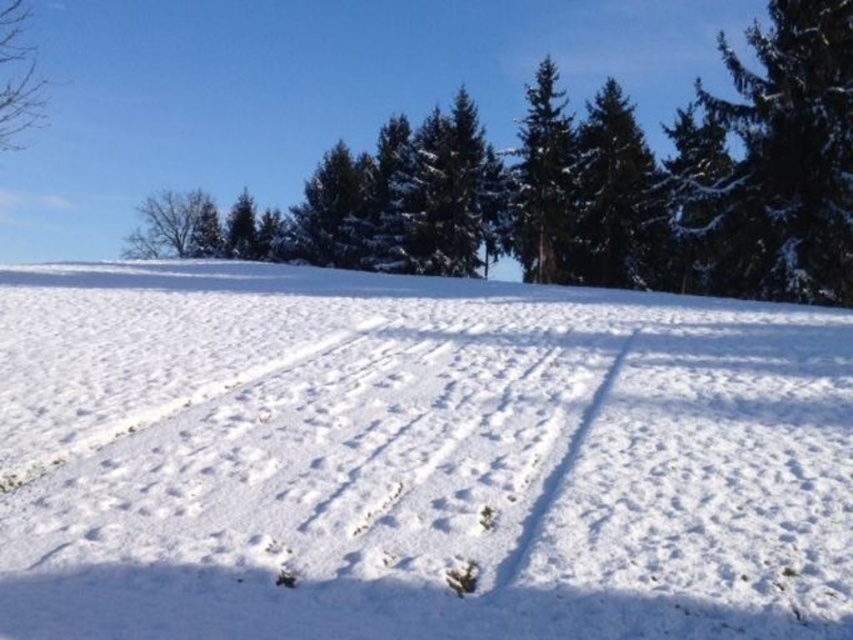
Can you confirm if green textured pine tree at center is taller than bare branches at left?

Yes.

Which is more to the right, green textured pine tree at center or bare branches at left?

From the viewer's perspective, green textured pine tree at center appears more on the right side.

Does point (537, 177) come in front of point (144, 224)?

That is True.

You are a GUI agent. You are given a task and a screenshot of the screen. Output one action in this format:
    pyautogui.click(x=<x>, y=<y>)
    Task: Click on the green textured pine tree at center
    This screenshot has height=640, width=853.
    Given the screenshot: What is the action you would take?
    pyautogui.click(x=543, y=179)

Looking at this image, who is more distant from viewer, (769,449) or (821,259)?

Point (821,259)

Can you confirm if white snow at center is smaller than green textured pine tree at upper right?

Yes.

Does point (79, 568) come closer to viewer compared to point (831, 273)?

Yes, point (79, 568) is closer to viewer.

The height and width of the screenshot is (640, 853). I want to click on white snow at center, so click(x=415, y=458).

Does point (144, 620) come closer to viewer compared to point (614, 275)?

Yes, it is in front of point (614, 275).

Is white snow at center wider than green matte tree at upper center?

Yes, white snow at center is wider than green matte tree at upper center.

Locate an element on the screen. This screenshot has width=853, height=640. white snow at center is located at coordinates (415, 458).